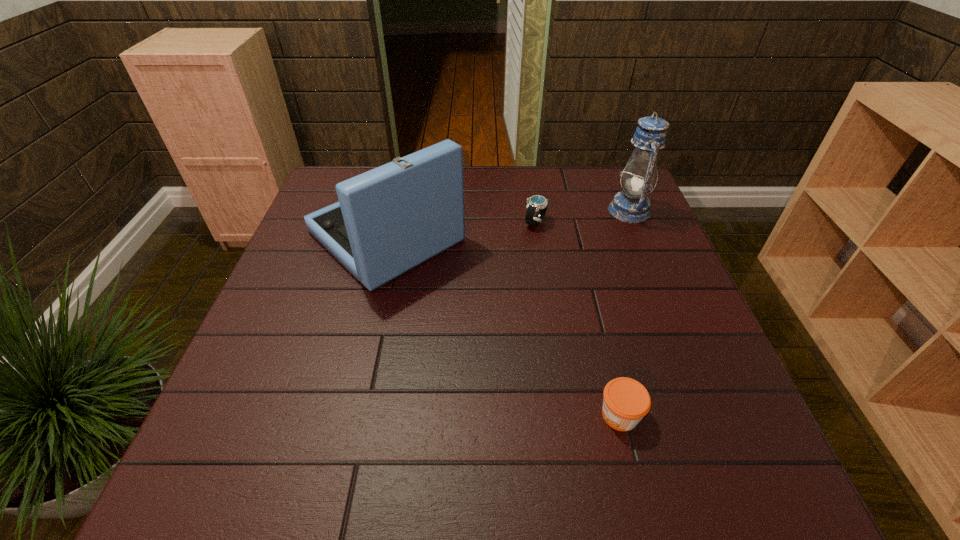
At what (x,y) coordinates should I click in order to perform the action: click on vacant space located on the front label of the nearest object. Please return your answer as a coordinate pair (x, y). Looking at the image, I should click on (396, 415).

You are a GUI agent. You are given a task and a screenshot of the screen. Output one action in this format:
    pyautogui.click(x=<x>, y=<y>)
    Task: Click on the vacant area situated on the front label of the nearest object
    Image resolution: width=960 pixels, height=540 pixels.
    Given the screenshot: What is the action you would take?
    tap(549, 415)

The image size is (960, 540). Find the location of `free space located 0.270m on the front label of the nearest object`. free space located 0.270m on the front label of the nearest object is located at coordinates (451, 415).

Identify the location of lantern at the far edge. (631, 205).

Find the location of a particular element. The height and width of the screenshot is (540, 960). phonograph record that is positioned at the far edge is located at coordinates (388, 220).

Identify the location of object that is at the left edge. (388, 220).

Locate an element on the screen. This screenshot has height=540, width=960. object that is at the right edge is located at coordinates (631, 205).

Where is `object situated at the far left corner`? object situated at the far left corner is located at coordinates (388, 220).

What are the coordinates of `object that is at the far right corner` in the screenshot? It's located at (631, 205).

Locate an element on the screen. vacant space at the far edge of the desktop is located at coordinates (572, 180).